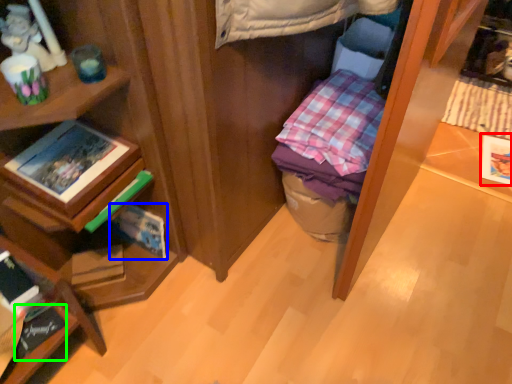
Question: Considering the real-world distances, which object is farthest from paperback book (highlighted by a red box)? paperback book (highlighted by a blue box) or book (highlighted by a green box)?

Choices:
 (A) paperback book
 (B) book

Answer: (B)